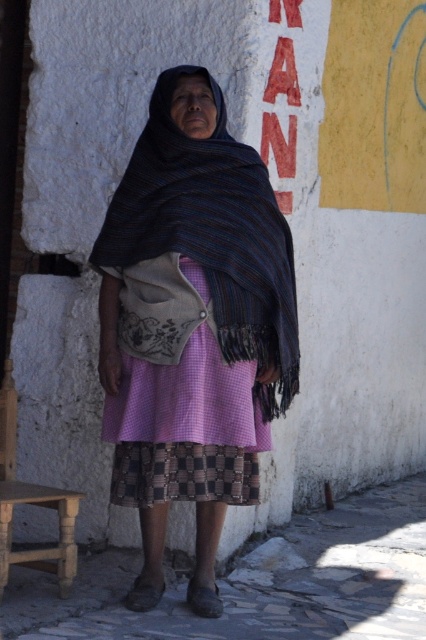
Question: Estimate the real-world distances between objects in this image. Which object is closer to the pink checkered dress at center?

Choices:
 (A) wooden stool at lower left
 (B) red painted sign at upper center

Answer: (A)

Question: Considering the relative positions of multicolored woven shawl at center and wooden stool at lower left in the image provided, where is multicolored woven shawl at center located with respect to wooden stool at lower left?

Choices:
 (A) right
 (B) left

Answer: (A)

Question: Can you confirm if multicolored woven shawl at center is wider than wooden stool at lower left?

Choices:
 (A) yes
 (B) no

Answer: (A)

Question: Can you confirm if multicolored woven shawl at center is smaller than red painted sign at upper center?

Choices:
 (A) no
 (B) yes

Answer: (A)

Question: Which point is farther from the camera taking this photo?

Choices:
 (A) (14, 554)
 (B) (270, 13)
 (C) (204, 472)

Answer: (B)

Question: Which object is positioned closest to the multicolored woven shawl at center?

Choices:
 (A) wooden stool at lower left
 (B) red painted sign at upper center

Answer: (A)